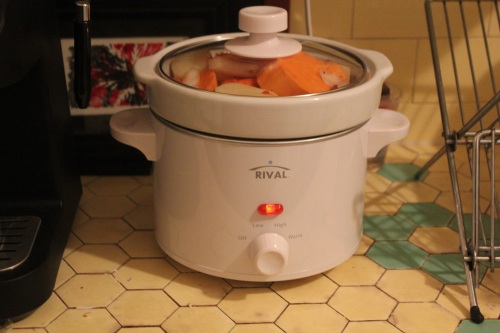
Image resolution: width=500 pixels, height=333 pixels. Find the location of `setting knob`. setting knob is located at coordinates (272, 251).